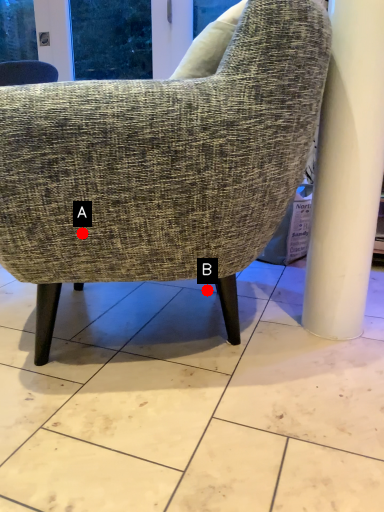
Question: Two points are circled on the image, labeled by A and B beside each circle. Which point is closer to the camera?

Choices:
 (A) A is closer
 (B) B is closer

Answer: (A)